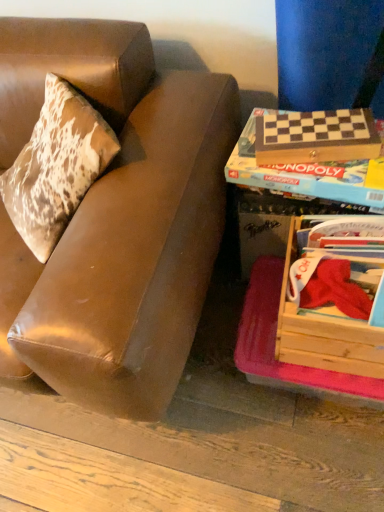
The height and width of the screenshot is (512, 384). I want to click on free space above wooden checkered board at right, which is the 2th paperback book from bottom to top (from a real-world perspective), so click(312, 124).